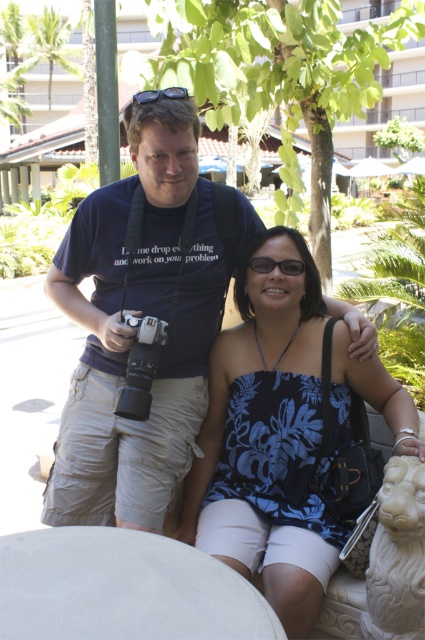
Based on the photo, you are a photographer trying to capture both the matte blue shirt at center and the blue floral tank top at center in a single frame. Which one should you position closer to the camera to ensure both are in focus?

To ensure both the matte blue shirt at center and the blue floral tank top at center are in focus, position the matte blue shirt at center closer to the camera since it is already to the left of the blue floral tank top at center.